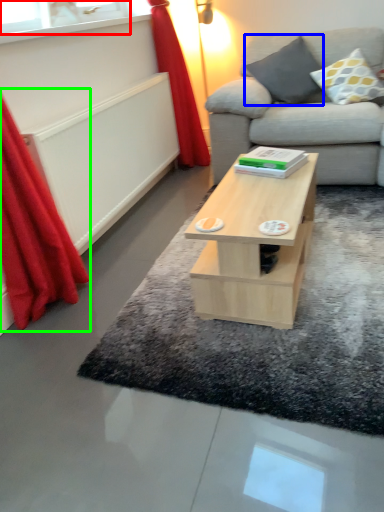
Question: Which object is the closest to the window (highlighted by a red box)? Choose among these: pillow (highlighted by a blue box) or curtain (highlighted by a green box).

Choices:
 (A) pillow
 (B) curtain

Answer: (B)